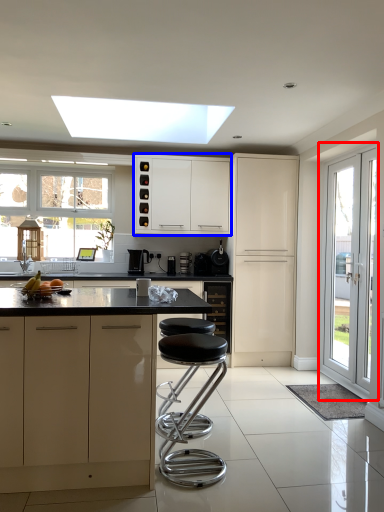
Question: Which of the following is the closest to the observer, door (highlighted by a red box) or cabinetry (highlighted by a blue box)?

Choices:
 (A) door
 (B) cabinetry

Answer: (A)